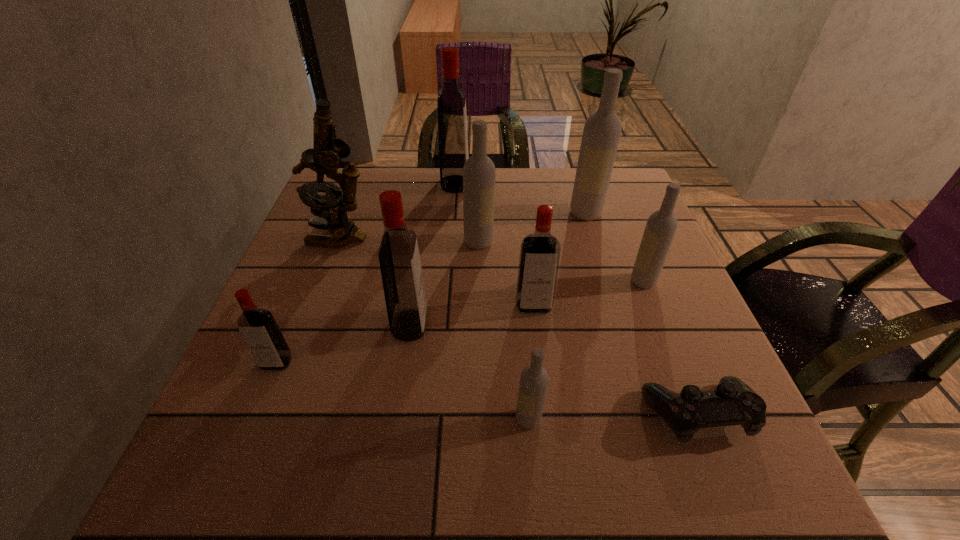
Locate an element on the screen. This screenshot has width=960, height=540. the farthest red vodka is located at coordinates (452, 119).

The width and height of the screenshot is (960, 540). In order to click on the farthest object in this screenshot , I will do `click(452, 119)`.

Identify the location of the farthest white vodka. The image size is (960, 540). (602, 130).

In order to click on the biggest white vodka in this screenshot , I will do `click(602, 130)`.

You are a GUI agent. You are given a task and a screenshot of the screen. Output one action in this format:
    pyautogui.click(x=<x>, y=<y>)
    Task: Click on the microscope
    The image size is (960, 540).
    Given the screenshot: What is the action you would take?
    pyautogui.click(x=324, y=158)

Identify the location of the second farthest white vodka. (479, 170).

At what (x,y) coordinates should I click in order to perform the action: click on the third smallest white vodka. Please return your answer as a coordinate pair (x, y). Looking at the image, I should click on (479, 170).

At what (x,y) coordinates should I click in order to perform the action: click on the third smallest red vodka. Please return your answer as a coordinate pair (x, y). Looking at the image, I should click on (400, 265).

Find the location of a particular element. This screenshot has width=960, height=540. the rightmost vodka is located at coordinates (661, 226).

Find the location of a particular element. The width and height of the screenshot is (960, 540). the third biggest white vodka is located at coordinates (661, 226).